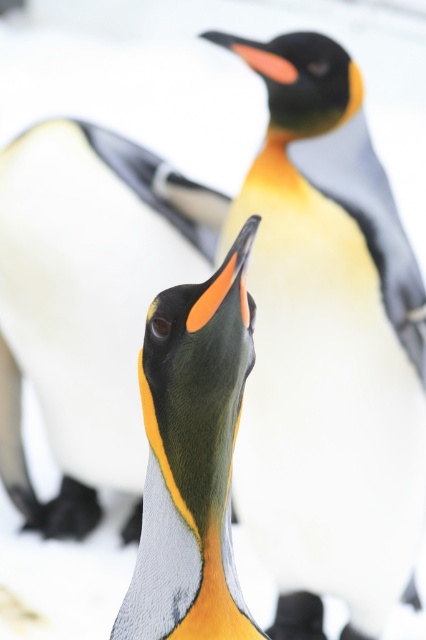
Is matte black penguin at center shorter than matte orange beak at center?

In fact, matte black penguin at center may be taller than matte orange beak at center.

Measure the distance between point (135, 196) and camera.

The distance of point (135, 196) from camera is 10.18 feet.

Between point (152, 156) and point (210, 468), which one is positioned behind?

Positioned behind is point (152, 156).

Locate an element on the screen. The width and height of the screenshot is (426, 640). matte black penguin at center is located at coordinates (86, 301).

Does yellow-orange feathers at center appear on the left side of matte orange beak at center?

No, yellow-orange feathers at center is not to the left of matte orange beak at center.

Can you confirm if yellow-orange feathers at center is thinner than matte orange beak at center?

No, yellow-orange feathers at center is not thinner than matte orange beak at center.

Who is more forward, (287, 612) or (175, 545)?

Point (175, 545) is more forward.

Find the location of a particular element. yellow-orange feathers at center is located at coordinates (328, 348).

Is yellow-orange feathers at center smaller than matte black penguin at center?

Indeed, yellow-orange feathers at center has a smaller size compared to matte black penguin at center.

Who is taller, yellow-orange feathers at center or matte black penguin at center?

yellow-orange feathers at center is taller.

Is point (279, 212) less distant than point (126, 412)?

Yes, it is.

This screenshot has height=640, width=426. I want to click on yellow-orange feathers at center, so click(328, 348).